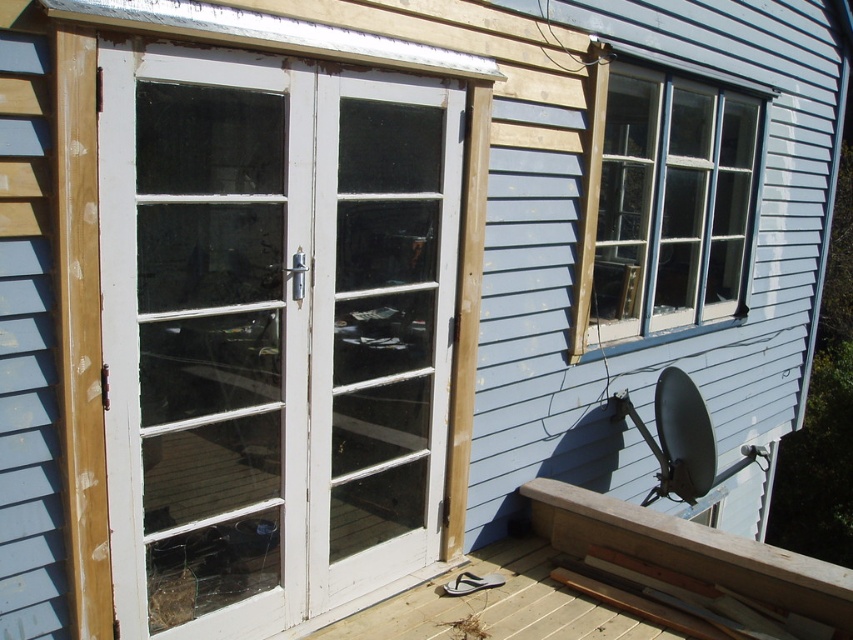
You are a delivery person trying to deliver a package to the house. You see the white wood screen door at center and the white wood door at center. Which door should you use to enter?

The white wood screen door at center is wider than the white wood door at center, so you should use the white wood screen door at center to enter since it provides more space for carrying the package.

You are a painter who needs to determine which object, the white wood screen door at center or the clear glass window at upper right, requires more vertical space for painting. Based on their heights, which one should you prioritize first?

The white wood screen door at center has a greater height compared to the clear glass window at upper right, so you should prioritize painting the white wood screen door at center first because it requires more vertical space.